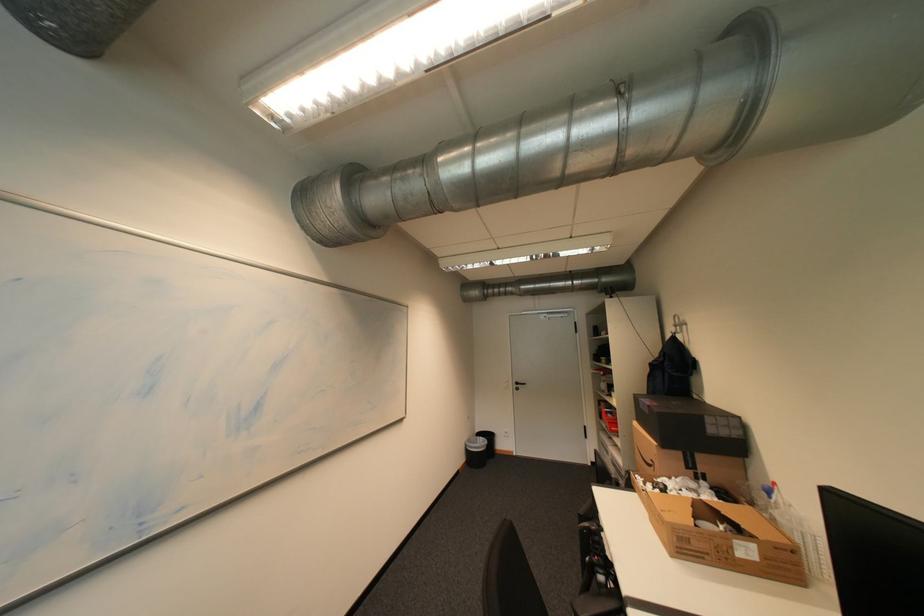
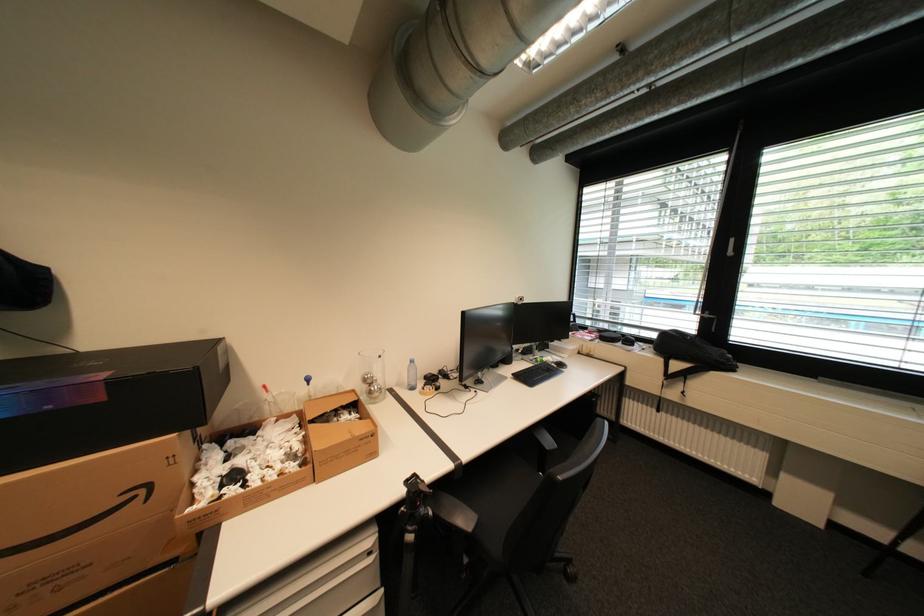
In the second image, find the point that corresponds to [666,516] in the first image.

(370, 440)